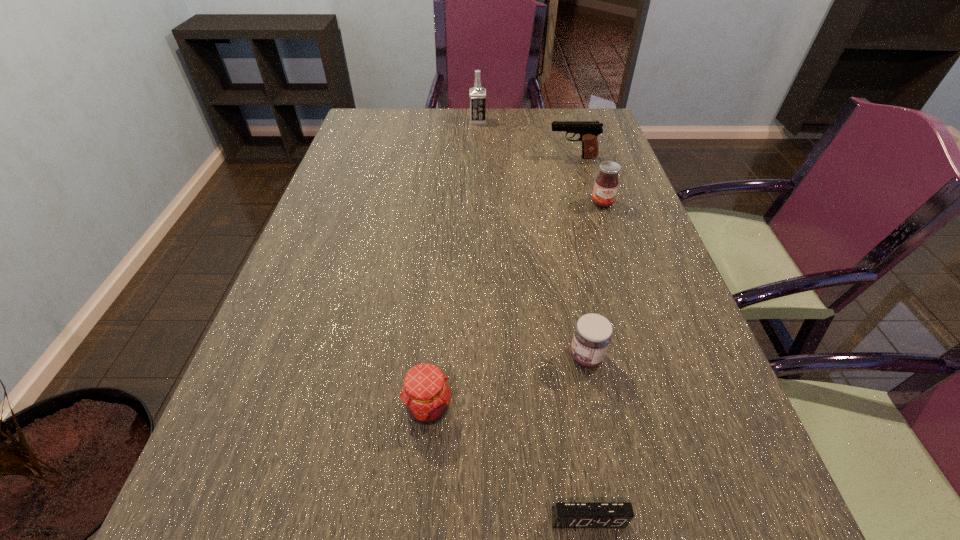
What are the coordinates of `free spot that satisfies the following two spatial constraints: 1. on the front label of the second nearest jam; 2. on the front-facing side of the nearest object` in the screenshot? It's located at (619, 518).